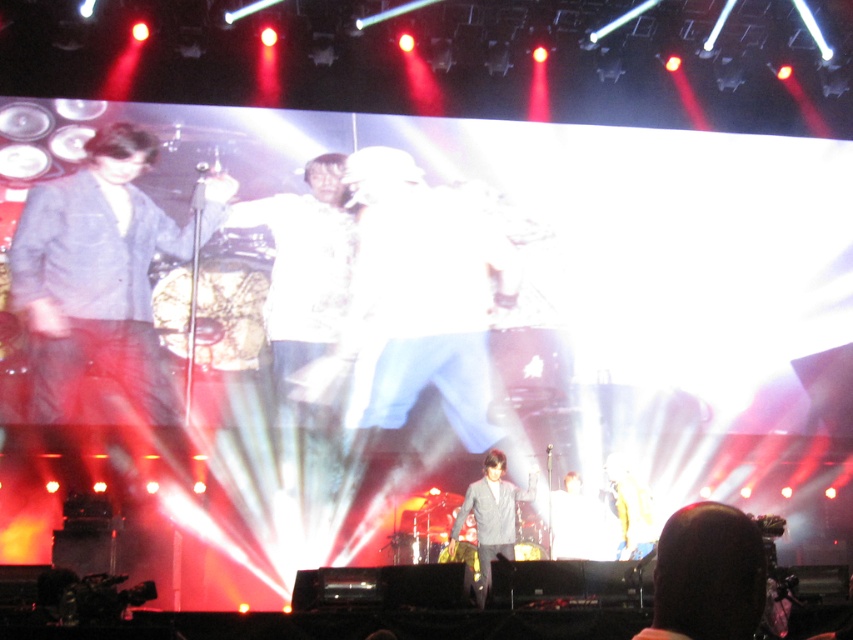
Question: Does dark brown hair at lower right come behind gray wool jacket at center?

Choices:
 (A) yes
 (B) no

Answer: (B)

Question: Which point appears closest to the camera in this image?

Choices:
 (A) (711, 513)
 (B) (491, 490)

Answer: (A)

Question: Does dark brown hair at lower right lie in front of gray wool jacket at center?

Choices:
 (A) yes
 (B) no

Answer: (A)

Question: Which point is farther to the camera?

Choices:
 (A) (x=514, y=499)
 (B) (x=752, y=568)

Answer: (A)

Question: Which object is closer to the camera taking this photo?

Choices:
 (A) gray wool jacket at center
 (B) dark brown hair at lower right

Answer: (B)

Question: Does dark brown hair at lower right appear over gray wool jacket at center?

Choices:
 (A) no
 (B) yes

Answer: (B)